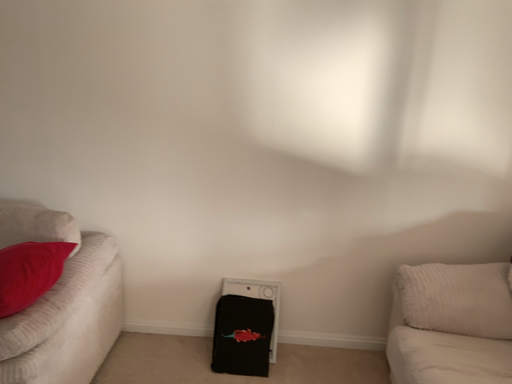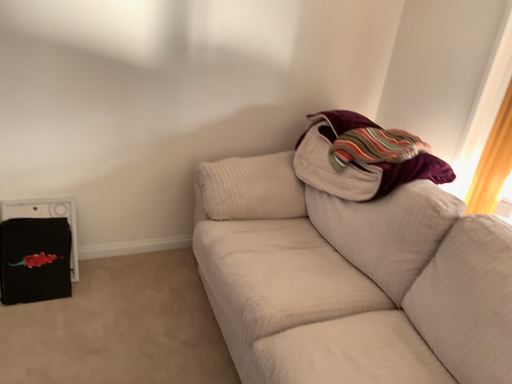
Question: How did the camera likely rotate when shooting the video?

Choices:
 (A) rotated downward
 (B) rotated upward

Answer: (A)